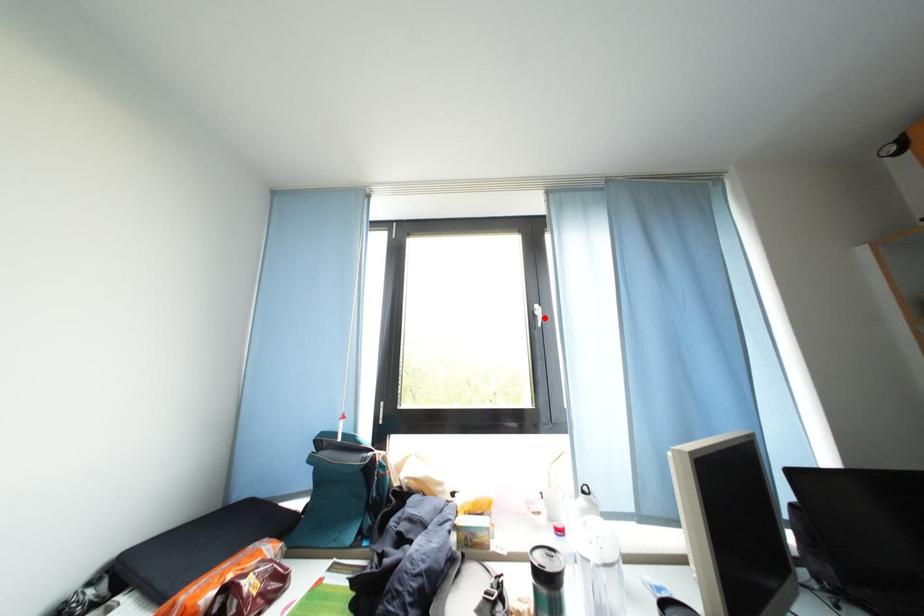
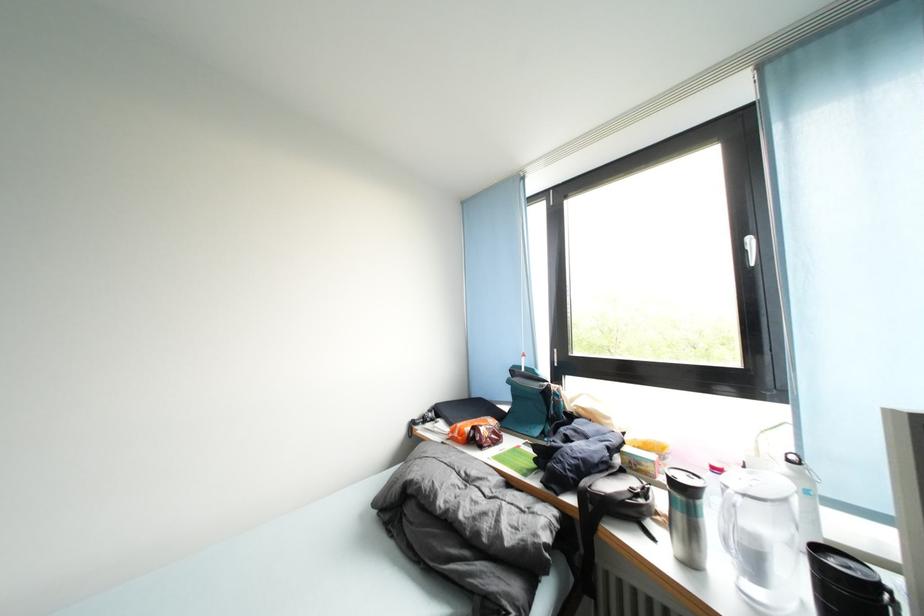
In the second image, find the point that corresponds to the highlighted location in the first image.

(757, 253)